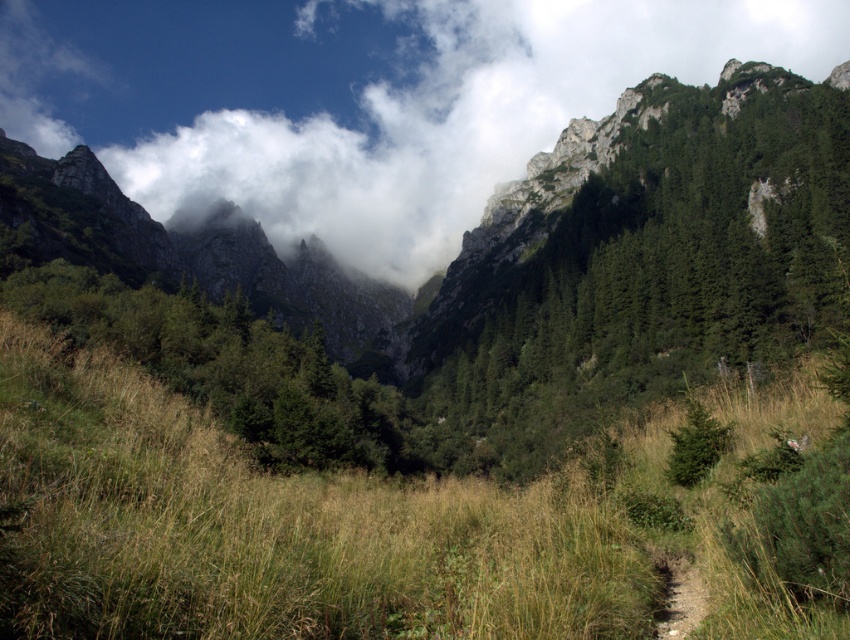
Consider the image. You are planning a hiking trip and see the image. You want to know if the white fluffy cloud at upper center is higher than the brown dirt trail at lower right. Can you determine this based on the scene?

The white fluffy cloud at upper center is much taller than the brown dirt trail at lower right, so yes, the white fluffy cloud at upper center is higher than the brown dirt trail at lower right.